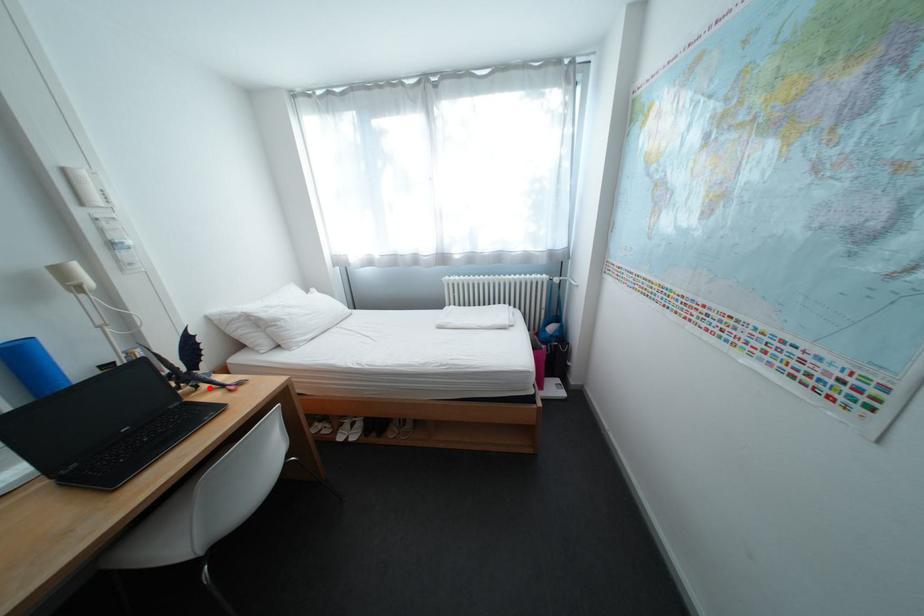
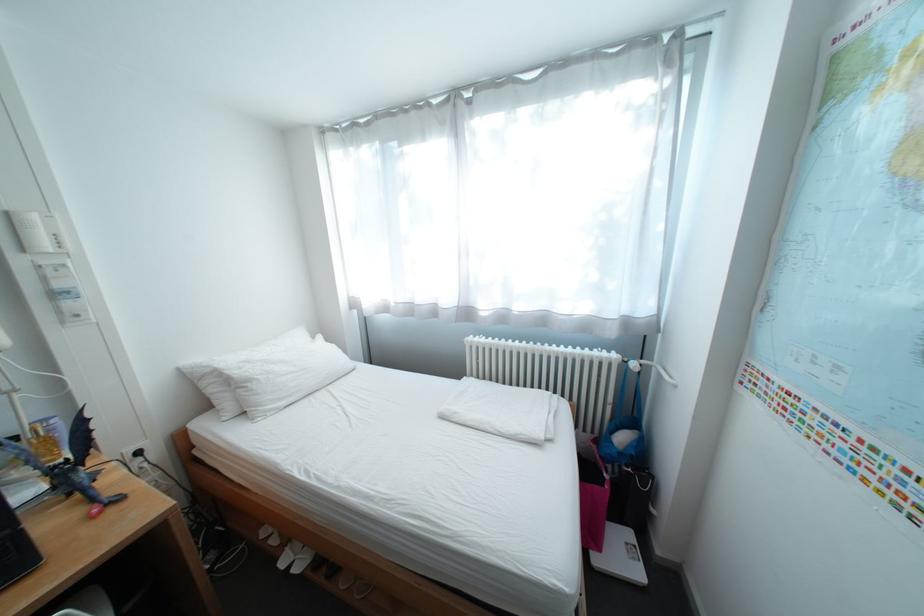
In the second image, find the point that corresponds to the highlighted location in the first image.

(81, 495)